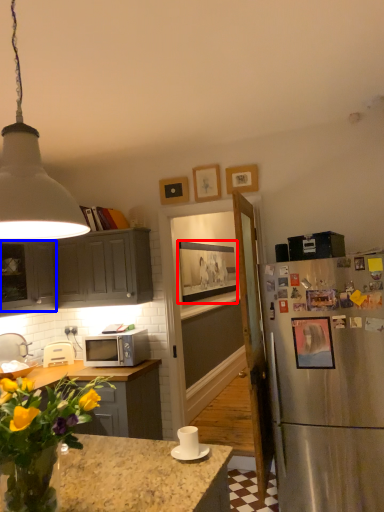
Question: Among these objects, which one is nearest to the camera, picture frame (highlighted by a red box) or cabinetry (highlighted by a blue box)?

Choices:
 (A) picture frame
 (B) cabinetry

Answer: (B)